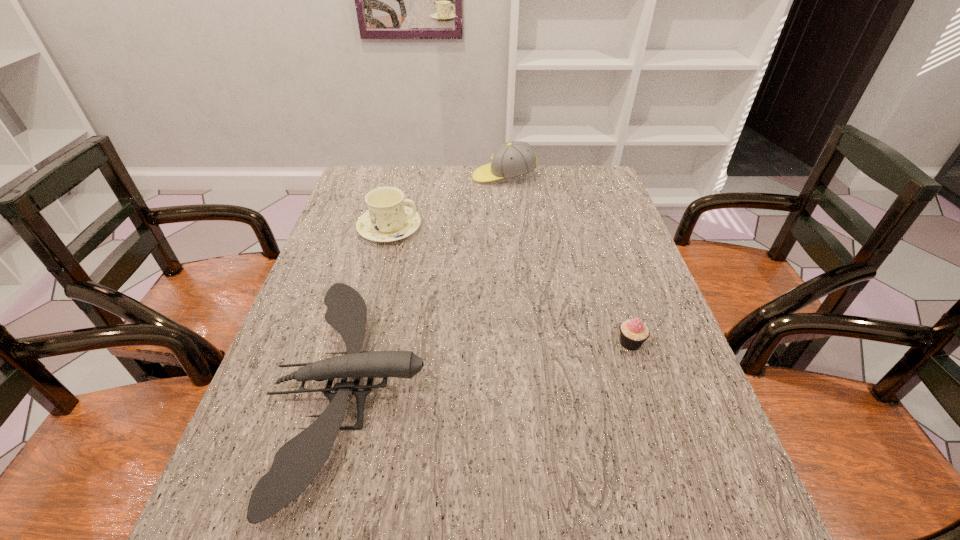
The image size is (960, 540). I want to click on vacant area situated 0.150m at the head of the drone, so click(x=499, y=388).

This screenshot has width=960, height=540. I want to click on free spot located on the front of the shortest object, so click(x=659, y=428).

Identify the location of object that is at the far edge. The width and height of the screenshot is (960, 540). (515, 158).

Where is `object positioned at the near edge`? object positioned at the near edge is located at coordinates (295, 465).

Where is `chinaware at the left edge`? The height and width of the screenshot is (540, 960). chinaware at the left edge is located at coordinates (388, 219).

Locate an element on the screen. drone situated at the left edge is located at coordinates (295, 465).

This screenshot has width=960, height=540. In order to click on object that is at the right edge in this screenshot , I will do `click(633, 332)`.

Identify the location of object that is at the near left corner. The height and width of the screenshot is (540, 960). (295, 465).

I want to click on blank area at the far edge, so click(539, 187).

You are a GUI agent. You are given a task and a screenshot of the screen. Output one action in this format:
    pyautogui.click(x=<x>, y=<y>)
    Task: Click on the vacant space at the left edge
    Image resolution: width=960 pixels, height=540 pixels.
    Given the screenshot: What is the action you would take?
    pyautogui.click(x=362, y=269)